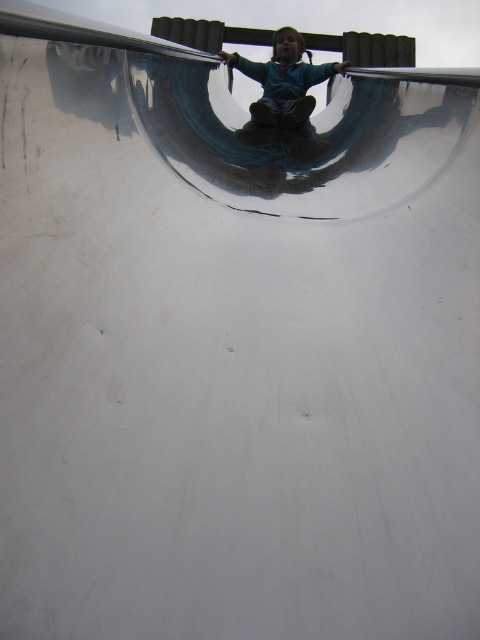
Is blue matte jacket at upper center shorter than shiny blue skateboard at upper center?

In fact, blue matte jacket at upper center may be taller than shiny blue skateboard at upper center.

Does blue matte jacket at upper center appear on the left side of shiny blue skateboard at upper center?

Indeed, blue matte jacket at upper center is positioned on the left side of shiny blue skateboard at upper center.

Find the location of a particular element. This screenshot has height=640, width=480. blue matte jacket at upper center is located at coordinates (284, 80).